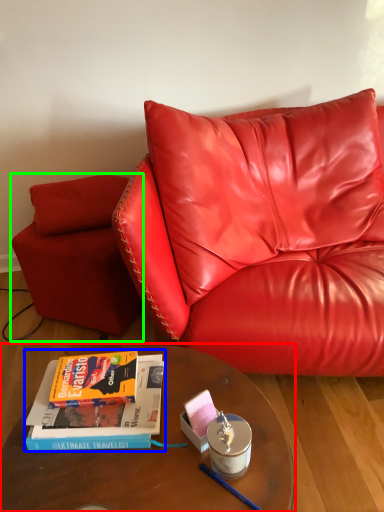
Question: Which object is the closest to the table (highlighted by a red box)? Choose among these: book (highlighted by a blue box) or armchair (highlighted by a green box).

Choices:
 (A) book
 (B) armchair

Answer: (A)